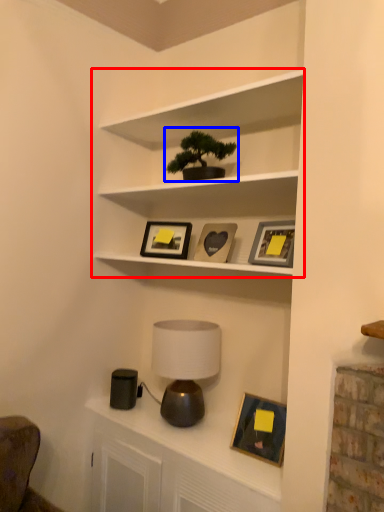
Question: Which object is closer to the camera taking this photo, shelf (highlighted by a red box) or houseplant (highlighted by a blue box)?

Choices:
 (A) shelf
 (B) houseplant

Answer: (A)